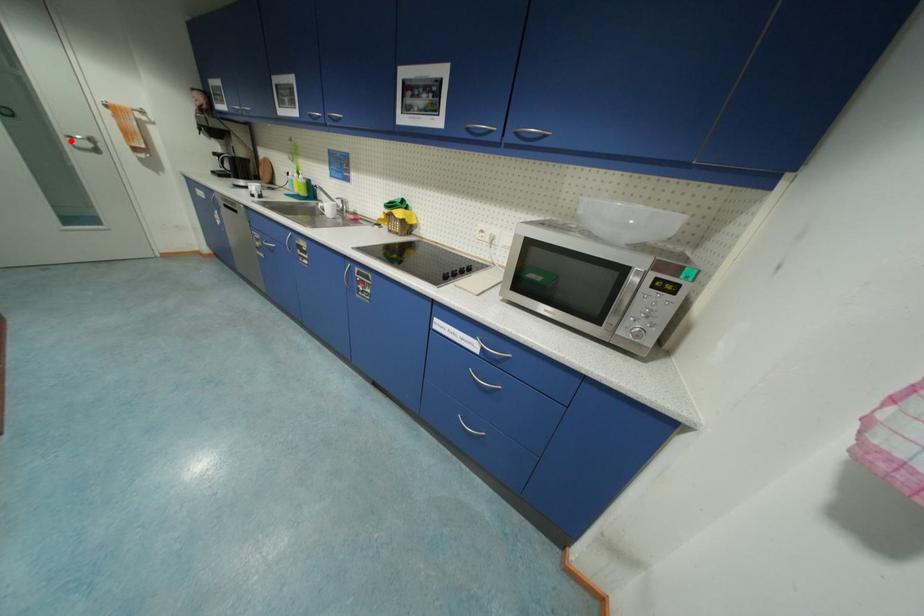
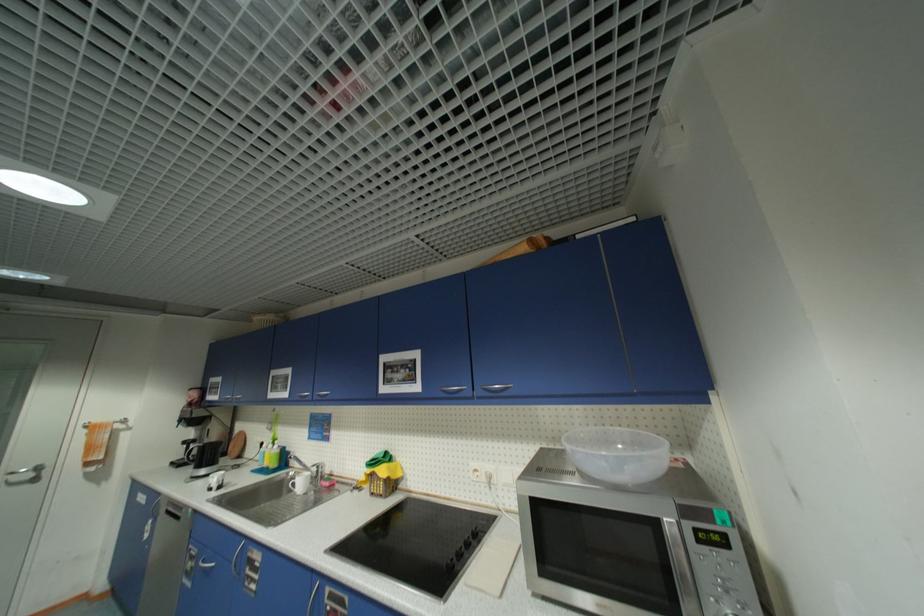
Question: I am providing you with two images of the same scene from different viewpoints. In image1, a red point is highlighted. Considering the same 3D point in image2, which of the following is correct?

Choices:
 (A) It is closer
 (B) It is farther

Answer: (A)